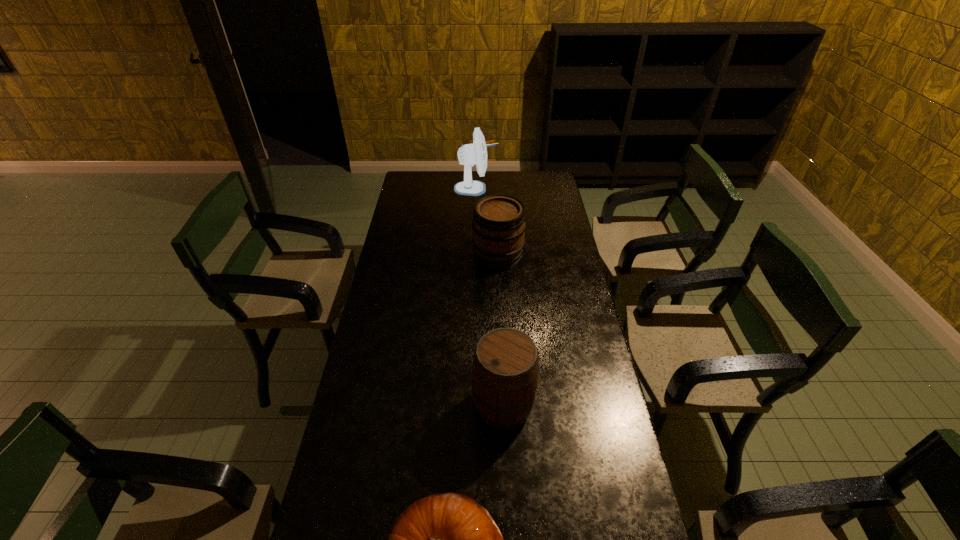
Find the location of a particular element. This screenshot has width=960, height=540. free space at the right edge of the desktop is located at coordinates (581, 313).

Where is `blank region between the nearer cider and the farthest object`? blank region between the nearer cider and the farthest object is located at coordinates (490, 297).

This screenshot has height=540, width=960. What are the coordinates of `vacant area that lies between the nearer cider and the tallest object` in the screenshot? It's located at (490, 297).

You are a GUI agent. You are given a task and a screenshot of the screen. Output one action in this format:
    pyautogui.click(x=<x>, y=<y>)
    Task: Click on the object that is the third nearest to the fan
    
    Given the screenshot: What is the action you would take?
    pyautogui.click(x=448, y=539)

Identify the location of object that stands as the third closest to the shortest object. Image resolution: width=960 pixels, height=540 pixels. (469, 154).

I want to click on blank space that satisfies the following two spatial constraints: 1. on the grille of the tallest object; 2. on the right side of the second nearest object, so click(x=473, y=405).

Image resolution: width=960 pixels, height=540 pixels. I want to click on vacant point that satisfies the following two spatial constraints: 1. on the grille of the farther cider; 2. on the left side of the farthest object, so click(475, 255).

At what (x,y) coordinates should I click in order to perform the action: click on blank space that satisfies the following two spatial constraints: 1. on the grille of the farthest object; 2. on the right side of the farther cider. Please return your answer as a coordinate pair (x, y). This screenshot has height=540, width=960. Looking at the image, I should click on (475, 255).

Locate an element on the screen. vacant region that satisfies the following two spatial constraints: 1. on the grille of the tallest object; 2. on the right side of the nearer cider is located at coordinates (473, 405).

The image size is (960, 540). I want to click on free spot that satisfies the following two spatial constraints: 1. on the grille of the farther cider; 2. on the left side of the tallest object, so click(x=475, y=255).